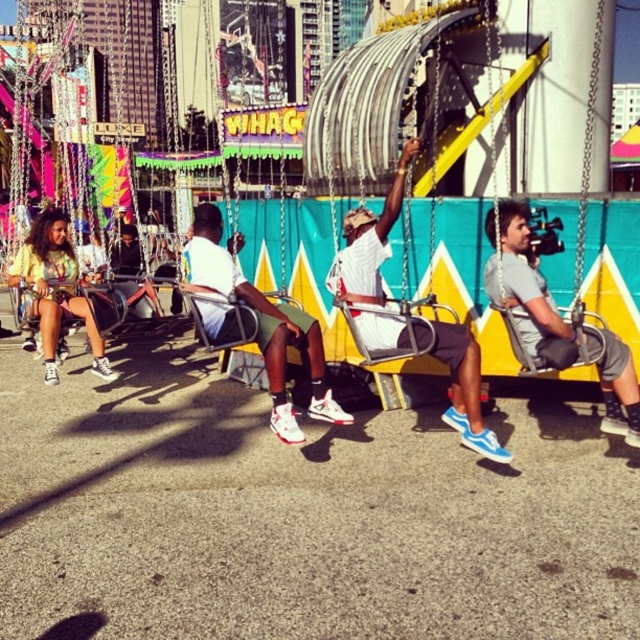
You are standing in the amusement park and see the white matte shirt at center and the gray fabric shorts at center on the swinging ride. Which one is positioned more to the left side?

The white matte shirt at center is positioned to the left of the gray fabric shorts at center, so the white matte shirt at center is more to the left.